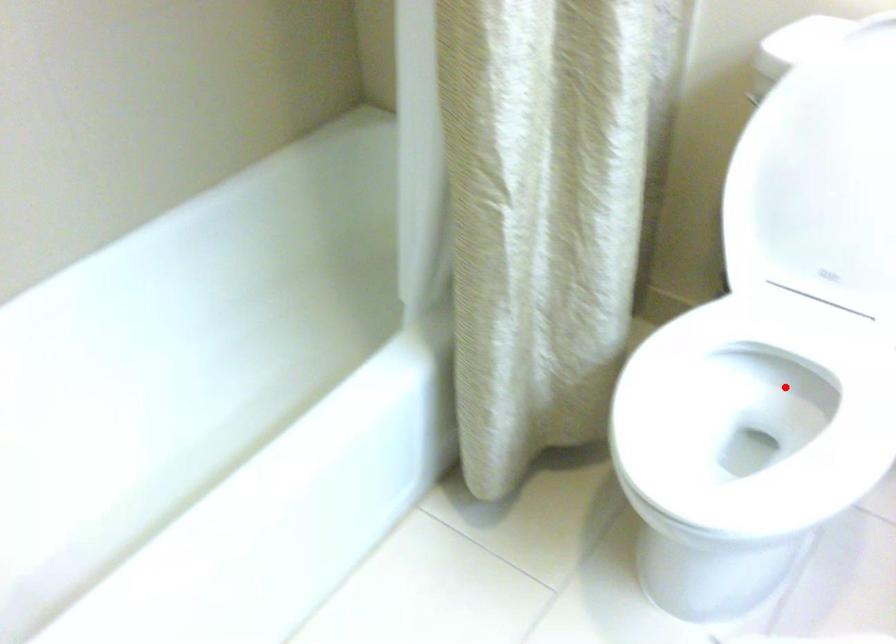
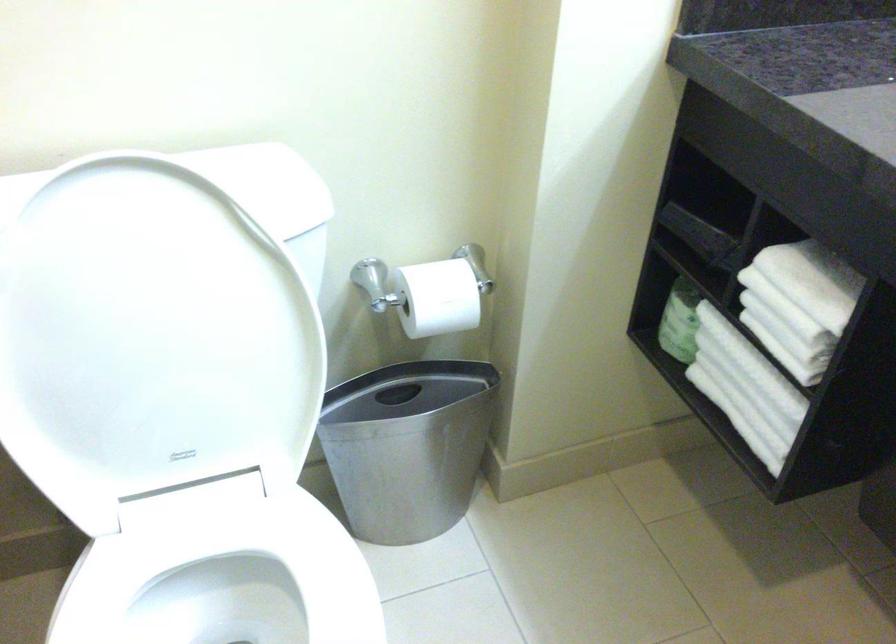
Question: I am providing you with two images of the same scene from different viewpoints. In image1, a red point is highlighted. Considering the same 3D point in image2, which of the following is correct?

Choices:
 (A) It is closer
 (B) It is farther

Answer: (A)